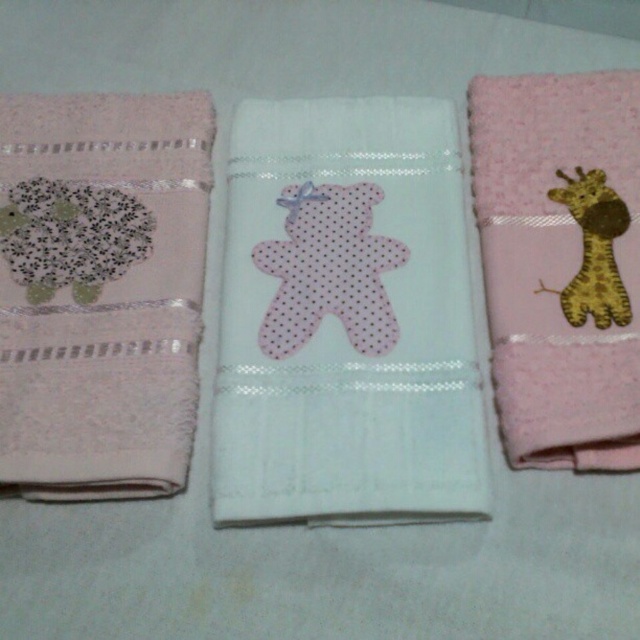
Is white textured towel with teddy bear at center further to the viewer compared to matte pink towel with sheep at left?

Yes.

At what (x,y) coordinates should I click in order to perform the action: click on white textured towel with teddy bear at center. Please return your answer as a coordinate pair (x, y). Looking at the image, I should click on (346, 316).

At what (x,y) coordinates should I click in order to perform the action: click on white textured towel with teddy bear at center. Please return your answer as a coordinate pair (x, y). The image size is (640, 640). Looking at the image, I should click on (346, 316).

You are a GUI agent. You are given a task and a screenshot of the screen. Output one action in this format:
    pyautogui.click(x=<x>, y=<y>)
    Task: Click on the white textured towel with teddy bear at center
    This screenshot has width=640, height=640.
    Given the screenshot: What is the action you would take?
    pyautogui.click(x=346, y=316)

Which is in front, point (268, 300) or point (388, 244)?

Positioned in front is point (268, 300).

Consider the image. Does white textured towel with teddy bear at center come behind pink dotted fabric bear at center?

No.

What do you see at coordinates (346, 316) in the screenshot? I see `white textured towel with teddy bear at center` at bounding box center [346, 316].

Find the location of a particular element. The height and width of the screenshot is (640, 640). white textured towel with teddy bear at center is located at coordinates (346, 316).

Can you confirm if pink fluffy towel with giraffe at right is thinner than pink dotted fabric bear at center?

No, pink fluffy towel with giraffe at right is not thinner than pink dotted fabric bear at center.

Between pink fluffy towel with giraffe at right and pink dotted fabric bear at center, which one has less height?

pink dotted fabric bear at center is shorter.

Does point (564, 250) come closer to viewer compared to point (332, 193)?

That is True.

The image size is (640, 640). What are the coordinates of `pink fluffy towel with giraffe at right` in the screenshot? It's located at (561, 262).